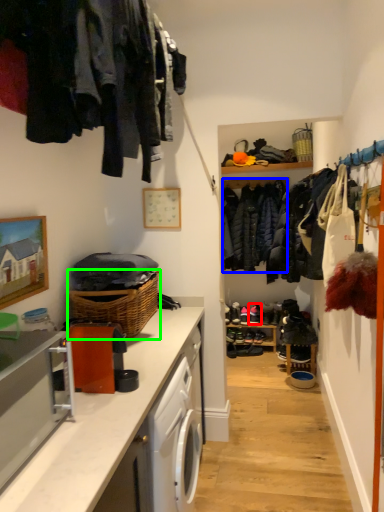
Question: Which object is positioned closest to shoe (highlighted by a red box)? Select from clothing (highlighted by a blue box) and basket (highlighted by a green box).

Choices:
 (A) clothing
 (B) basket

Answer: (A)